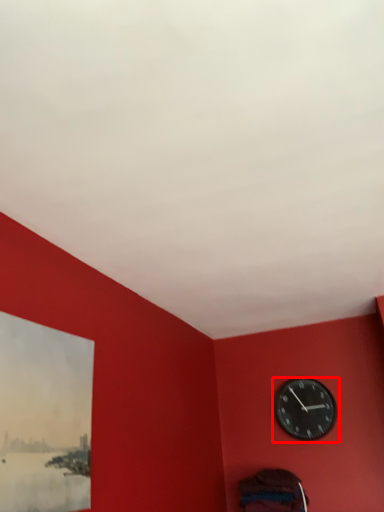
Question: In this image, where is wall clock (annotated by the red box) located relative to picture frame?

Choices:
 (A) right
 (B) left

Answer: (A)